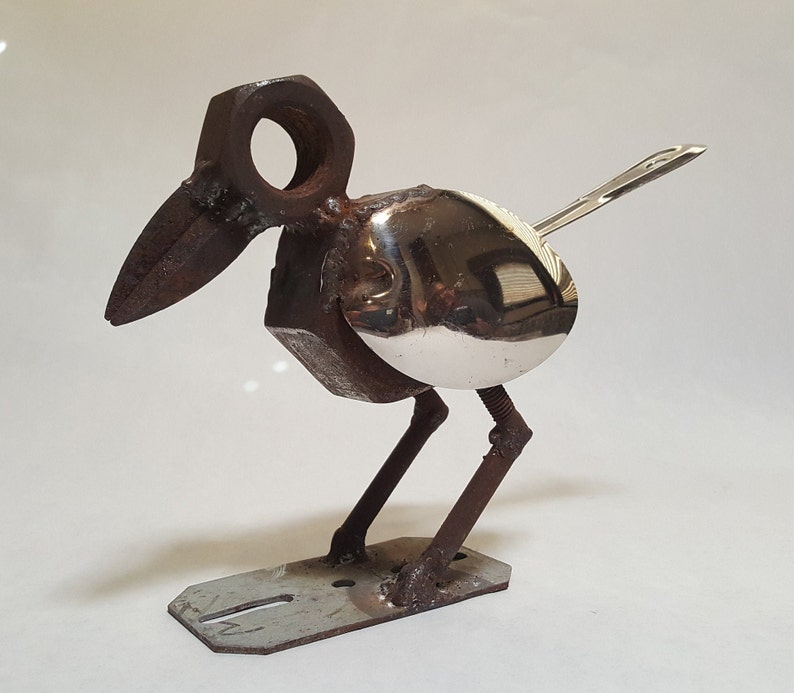
Where is `home decor`? home decor is located at coordinates (437, 335).